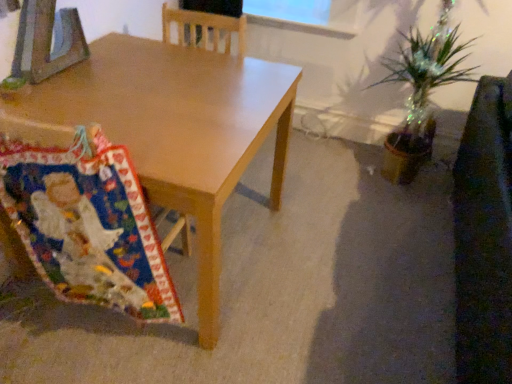
Question: Are dark brown leather swivel chair at right and multicolored fabric at lower left located far from each other?

Choices:
 (A) yes
 (B) no

Answer: (A)

Question: Can multicolored fabric at lower left be found inside dark brown leather swivel chair at right?

Choices:
 (A) yes
 (B) no

Answer: (B)

Question: Does dark brown leather swivel chair at right have a lesser height compared to multicolored fabric at lower left?

Choices:
 (A) yes
 (B) no

Answer: (B)

Question: Is dark brown leather swivel chair at right wider than multicolored fabric at lower left?

Choices:
 (A) no
 (B) yes

Answer: (B)

Question: Does dark brown leather swivel chair at right come in front of multicolored fabric at lower left?

Choices:
 (A) yes
 (B) no

Answer: (A)

Question: From a real-world perspective, is dark brown leather swivel chair at right on top of multicolored fabric at lower left?

Choices:
 (A) yes
 (B) no

Answer: (B)

Question: Can you confirm if matte wood desk at center is shorter than multicolored fabric at lower left?

Choices:
 (A) no
 (B) yes

Answer: (B)

Question: Is matte wood desk at center oriented away from multicolored fabric at lower left?

Choices:
 (A) yes
 (B) no

Answer: (B)

Question: Is matte wood desk at center wider than multicolored fabric at lower left?

Choices:
 (A) no
 (B) yes

Answer: (B)

Question: Does matte wood desk at center turn towards multicolored fabric at lower left?

Choices:
 (A) no
 (B) yes

Answer: (A)

Question: Does matte wood desk at center appear on the right side of multicolored fabric at lower left?

Choices:
 (A) no
 (B) yes

Answer: (B)

Question: From the image's perspective, is matte wood desk at center on multicolored fabric at lower left?

Choices:
 (A) yes
 (B) no

Answer: (A)

Question: Is dark brown leather swivel chair at right bigger than matte wood desk at center?

Choices:
 (A) no
 (B) yes

Answer: (A)